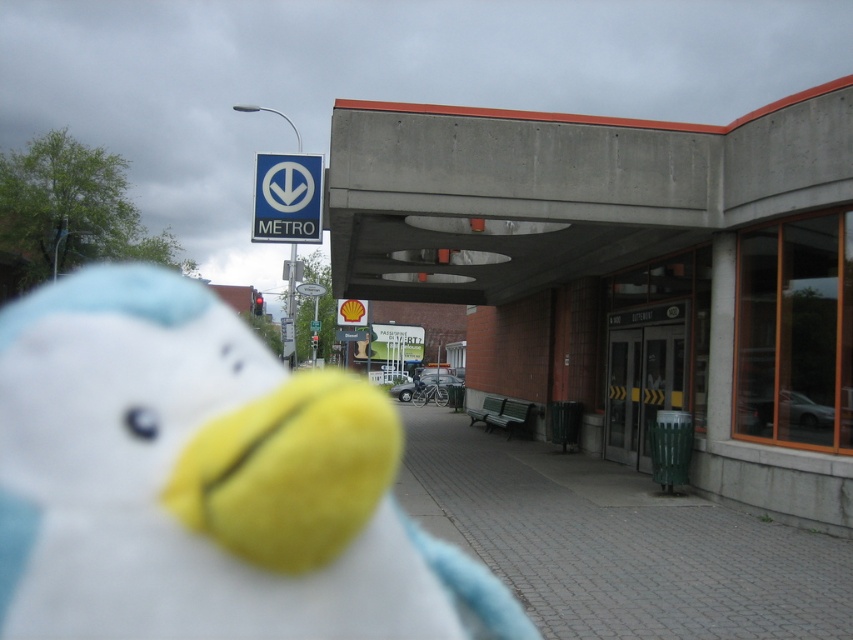
Question: Based on their relative distances, which object is nearer to the blue plastic sign at upper center?

Choices:
 (A) fluffy white toy at center
 (B) paved brick sidewalk at center

Answer: (B)

Question: Based on their relative distances, which object is farther from the paved brick sidewalk at center?

Choices:
 (A) fluffy white toy at center
 (B) blue plastic sign at upper center

Answer: (A)

Question: Estimate the real-world distances between objects in this image. Which object is farther from the blue plastic sign at upper center?

Choices:
 (A) fluffy white toy at center
 (B) paved brick sidewalk at center

Answer: (A)

Question: From the image, what is the correct spatial relationship of fluffy white toy at center in relation to blue plastic sign at upper center?

Choices:
 (A) below
 (B) above

Answer: (A)

Question: Is fluffy white toy at center bigger than paved brick sidewalk at center?

Choices:
 (A) no
 (B) yes

Answer: (B)

Question: Can you confirm if fluffy white toy at center is positioned to the left of blue plastic sign at upper center?

Choices:
 (A) yes
 (B) no

Answer: (A)